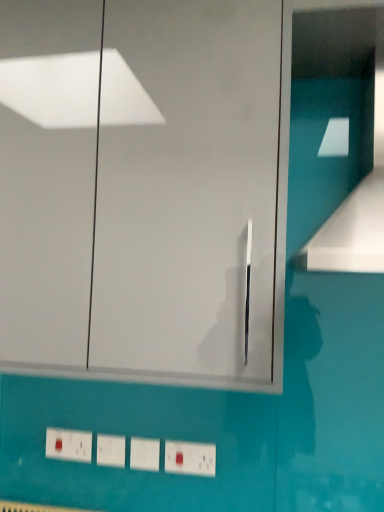
Where is `transparent glass door at center`? The height and width of the screenshot is (512, 384). transparent glass door at center is located at coordinates (187, 187).

This screenshot has width=384, height=512. I want to click on transparent glass door at center, so click(187, 187).

Is white plastic switch at lower center at the back of white glossy vent at upper right?

No, white glossy vent at upper right is not facing away from white plastic switch at lower center.

This screenshot has width=384, height=512. I want to click on switch that appears below the white glossy vent at upper right (from the image's perspective), so click(190, 458).

From the image's perspective, is white glossy vent at upper right beneath white plastic switch at lower center?

Actually, white glossy vent at upper right appears above white plastic switch at lower center in the image.

Does transparent glass door at center lie in front of white plastic switch at lower center?

Yes, transparent glass door at center is closer to the viewer.

Between transparent glass door at center and white plastic switch at lower center, which one has larger width?

Wider between the two is transparent glass door at center.

From the image's perspective, which one is positioned lower, transparent glass door at center or white plastic switch at lower center?

From the image's view, white plastic switch at lower center is below.

Does point (177, 469) appear closer or farther from the camera than point (120, 437)?

Clearly, point (177, 469) is closer to the camera than point (120, 437).

Considering the relative positions of white plastic switch at lower center and white plastic light switch at lower center in the image provided, is white plastic switch at lower center to the right of white plastic light switch at lower center from the viewer's perspective?

Yes.

Is white plastic switch at lower center in contact with white plastic light switch at lower center?

There is a gap between white plastic switch at lower center and white plastic light switch at lower center.

I want to click on switch lying in front of the white plastic light switch at lower center, so click(x=190, y=458).

Considering the positions of points (379, 93) and (68, 446), is point (379, 93) farther from camera compared to point (68, 446)?

No.

From their relative heights in the image, would you say white glossy vent at upper right is taller or shorter than matte white electric outlet at lower left?

white glossy vent at upper right is taller than matte white electric outlet at lower left.

From a real-world perspective, is white glossy vent at upper right positioned above or below matte white electric outlet at lower left?

Clearly, from a real-world perspective, white glossy vent at upper right is above matte white electric outlet at lower left.

How far apart are white glossy vent at upper right and transparent glass door at center?

A distance of 11.23 inches exists between white glossy vent at upper right and transparent glass door at center.

Is white glossy vent at upper right facing away from transparent glass door at center?

No.

Who is more distant, white glossy vent at upper right or transparent glass door at center?

transparent glass door at center is behind.

Which is behind, point (99, 446) or point (79, 458)?

The point (79, 458) is farther.

Is white plastic light switch at lower center further to camera compared to matte white electric outlet at lower left?

That is False.

Can you confirm if white plastic light switch at lower center is thinner than matte white electric outlet at lower left?

Indeed, white plastic light switch at lower center has a lesser width compared to matte white electric outlet at lower left.

Which object is positioned more to the left, transparent glass door at center or white plastic light switch at lower center?

white plastic light switch at lower center.

Between transparent glass door at center and white plastic light switch at lower center, which one has larger size?

transparent glass door at center.

From a real-world perspective, who is located lower, transparent glass door at center or white plastic light switch at lower center?

white plastic light switch at lower center, from a real-world perspective.

I want to click on switch on the left of the white glossy vent at upper right, so click(190, 458).

In the image, there is a transparent glass door at center. At what (x,y) coordinates should I click in order to perform the action: click on switch below it (from the image's perspective). Please return your answer as a coordinate pair (x, y). Image resolution: width=384 pixels, height=512 pixels. Looking at the image, I should click on (190, 458).

From the picture: When comparing their distances from white glossy vent at upper right, does matte white electric outlet at lower left or white plastic switch at lower center seem closer?

white plastic switch at lower center is positioned closer to the anchor white glossy vent at upper right.

When comparing their distances from white plastic light switch at lower center, does transparent glass door at center or white plastic switch at lower center seem further?

transparent glass door at center is positioned further to the anchor white plastic light switch at lower center.

From the image, which object appears to be farther from white plastic switch at lower center, transparent glass door at center or white glossy vent at upper right?

white glossy vent at upper right.

Estimate the real-world distances between objects in this image. Which object is further from matte white electric outlet at lower left, white plastic light switch at lower center or transparent glass door at center?

transparent glass door at center lies further to matte white electric outlet at lower left than the other object.

When comparing their distances from transparent glass door at center, does white plastic light switch at lower center or matte white electric outlet at lower left seem further?

matte white electric outlet at lower left lies further to transparent glass door at center than the other object.

Estimate the real-world distances between objects in this image. Which object is closer to white plastic switch at lower center, white plastic light switch at lower center or matte white electric outlet at lower left?

white plastic light switch at lower center is closer to white plastic switch at lower center.

Which object lies further to the anchor point white plastic light switch at lower center, transparent glass door at center or matte white electric outlet at lower left?

Based on the image, transparent glass door at center appears to be further to white plastic light switch at lower center.

When comparing their distances from matte white electric outlet at lower left, does white plastic switch at lower center or white plastic light switch at lower center seem further?

The object further to matte white electric outlet at lower left is white plastic switch at lower center.

The image size is (384, 512). What are the coordinates of `glass door that lies between white glossy vent at upper right and white plastic light switch at lower center from top to bottom` in the screenshot? It's located at coord(187,187).

Find the location of a particular element. This screenshot has width=384, height=512. electric outlet between transparent glass door at center and white plastic switch at lower center in the vertical direction is located at coordinates (69, 445).

Locate an element on the screen. The height and width of the screenshot is (512, 384). light switch between white glossy vent at upper right and white plastic switch at lower center in the vertical direction is located at coordinates (111, 450).

This screenshot has height=512, width=384. What are the coordinates of `glass door between white glossy vent at upper right and matte white electric outlet at lower left vertically` in the screenshot? It's located at (187, 187).